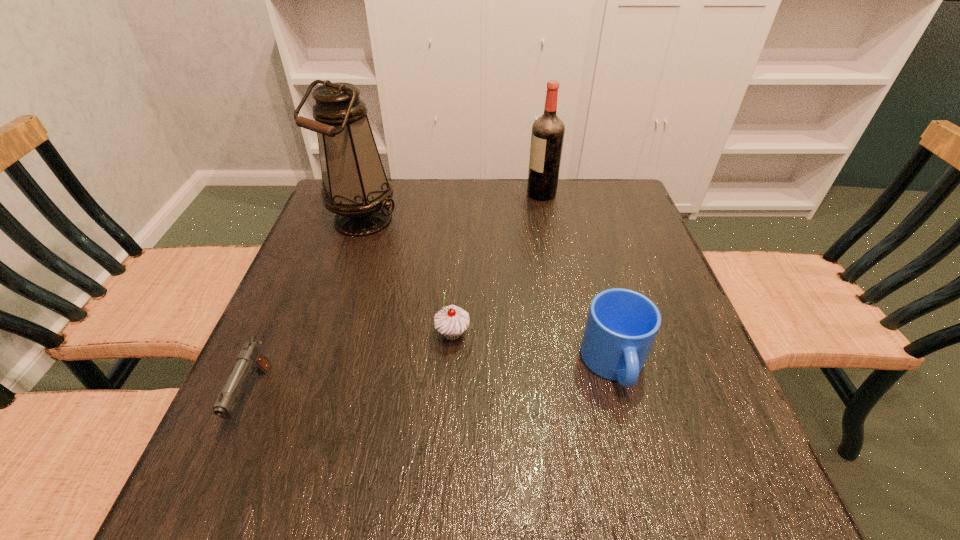
The width and height of the screenshot is (960, 540). In order to click on free space between the oil lamp and the cupcake in this screenshot , I will do `click(408, 277)`.

Where is `free point between the mug and the third object from left to right`? This screenshot has width=960, height=540. free point between the mug and the third object from left to right is located at coordinates (534, 349).

I want to click on free area in between the mug and the oil lamp, so click(489, 293).

Where is `free spot between the oil lamp and the mug`? free spot between the oil lamp and the mug is located at coordinates (489, 293).

You are a GUI agent. You are given a task and a screenshot of the screen. Output one action in this format:
    pyautogui.click(x=<x>, y=<y>)
    Task: Click on the object identified as the closest to the mug
    This screenshot has width=960, height=540.
    Given the screenshot: What is the action you would take?
    pyautogui.click(x=451, y=321)

Locate an element on the screen. This screenshot has height=540, width=960. object that is the second closest one to the oil lamp is located at coordinates (547, 137).

Identify the location of free point that satisfies the following two spatial constraints: 1. on the front-facing side of the liquor; 2. in the direction the gun is aimed. (580, 397).